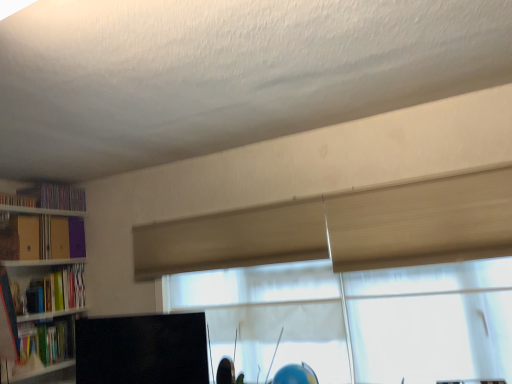
Describe the element at coordinates (142, 349) in the screenshot. I see `black matte computer monitor at lower center` at that location.

How much space does purple cardboard book at upper left, positioned as the 5th book in bottom-to-top order, occupy horizontally?

The width of purple cardboard book at upper left, positioned as the 5th book in bottom-to-top order, is 3.42 inches.

I want to click on purple cardboard book at upper left, positioned as the 5th book in bottom-to-top order, so click(x=18, y=200).

In order to face hardcover book at left, positioned as the 4th book in top-to-bottom order, should I rotate leftwards or rightwards?

Rotate your view left by about 25.379°.

Image resolution: width=512 pixels, height=384 pixels. What do you see at coordinates (48, 340) in the screenshot? I see `matte green book at left, which ranks as the 1th book in bottom-to-top order` at bounding box center [48, 340].

In order to face translucent wood glass door at upper right, should I rotate leftwards or rightwards?

You should look right and rotate roughly 22.272 degrees.

Describe the element at coordinates (44, 280) in the screenshot. I see `wooden bookshelf at left` at that location.

At what (x,y) coordinates should I click in order to perform the action: click on black matte computer monitor at lower center. Please return your answer as a coordinate pair (x, y). The width and height of the screenshot is (512, 384). Looking at the image, I should click on (142, 349).

In the scene shown: Is translucent fabric window at center to the left of translucent wood glass door at upper right from the viewer's perspective?

Yes, translucent fabric window at center is to the left of translucent wood glass door at upper right.

Is translucent fabric window at center next to translucent wood glass door at upper right and touching it?

No, translucent fabric window at center is not next to translucent wood glass door at upper right.

From the picture: Which of these two, translucent fabric window at center or translucent wood glass door at upper right, is smaller?

translucent wood glass door at upper right.

The width and height of the screenshot is (512, 384). Identify the location of the 2nd book behind the matte yellow folder at left, the third book from the top, starting your count from the anchor. (48, 197).

How different are the orientations of matte yellow folder at left, the third book from the top, and matte plastic bookshelf at left, which appears as the 2th book when viewed from the top, in degrees?

The facing directions of matte yellow folder at left, the third book from the top, and matte plastic bookshelf at left, which appears as the 2th book when viewed from the top, are 3.21 degrees apart.

From the image's perspective, relative to matte plastic bookshelf at left, the fourth book in the bottom-to-top sequence, is matte yellow folder at left, the third book from the top, above or below?

From the image's perspective, matte yellow folder at left, the third book from the top, appears below matte plastic bookshelf at left, the fourth book in the bottom-to-top sequence.

Is matte yellow folder at left, arranged as the 3th book when ordered from the bottom, located outside matte plastic bookshelf at left, which appears as the 2th book when viewed from the top?

Yes, matte yellow folder at left, arranged as the 3th book when ordered from the bottom, is outside of matte plastic bookshelf at left, which appears as the 2th book when viewed from the top.

How many degrees apart are the facing directions of purple cardboard book at upper left, positioned as the 5th book in bottom-to-top order, and translucent fabric window at center?

They differ by 88.8 degrees in their facing directions.

Looking at this image, is purple cardboard book at upper left, positioned as the 5th book in bottom-to-top order, facing towards translucent fabric window at center?

No, purple cardboard book at upper left, positioned as the 5th book in bottom-to-top order, is not oriented towards translucent fabric window at center.

From a real-world perspective, is purple cardboard book at upper left, positioned as the 5th book in bottom-to-top order, above or below translucent fabric window at center?

purple cardboard book at upper left, positioned as the 5th book in bottom-to-top order, is above translucent fabric window at center.

Is purple cardboard book at upper left, positioned as the 5th book in bottom-to-top order, wider than translucent fabric window at center?

Incorrect, the width of purple cardboard book at upper left, positioned as the 5th book in bottom-to-top order, does not surpass that of translucent fabric window at center.

Does hardcover book at left, which appears as the second book when ordered from the bottom, touch purple cardboard book at upper left, positioned as the 5th book in bottom-to-top order?

They are not placed beside each other.

Is hardcover book at left, which appears as the second book when ordered from the bottom, not inside purple cardboard book at upper left, which ranks as the 1th book in top-to-bottom order?

Yes, hardcover book at left, which appears as the second book when ordered from the bottom, is located beyond the bounds of purple cardboard book at upper left, which ranks as the 1th book in top-to-bottom order.

From the image's perspective, relative to purple cardboard book at upper left, positioned as the 5th book in bottom-to-top order, is hardcover book at left, which appears as the second book when ordered from the bottom, above or below?

Based on their image positions, hardcover book at left, which appears as the second book when ordered from the bottom, is located beneath purple cardboard book at upper left, positioned as the 5th book in bottom-to-top order.

Can you confirm if hardcover book at left, positioned as the 4th book in top-to-bottom order, is shorter than purple cardboard book at upper left, which ranks as the 1th book in top-to-bottom order?

In fact, hardcover book at left, positioned as the 4th book in top-to-bottom order, may be taller than purple cardboard book at upper left, which ranks as the 1th book in top-to-bottom order.

Consider the image. How many degrees apart are the facing directions of translucent wood glass door at upper right and wooden bookshelf at left?

They differ by 94 degrees in their facing directions.

Is translucent wood glass door at upper right directly adjacent to wooden bookshelf at left?

No.

Can you confirm if translucent wood glass door at upper right is taller than wooden bookshelf at left?

Indeed, translucent wood glass door at upper right has a greater height compared to wooden bookshelf at left.

From a real-world perspective, which object stands above the other?

wooden bookshelf at left is physically above.

Considering the relative positions of wooden bookshelf at left and matte plastic bookshelf at left, which appears as the 2th book when viewed from the top, in the image provided, is wooden bookshelf at left to the left or to the right of matte plastic bookshelf at left, which appears as the 2th book when viewed from the top,?

In the image, wooden bookshelf at left appears on the right side of matte plastic bookshelf at left, which appears as the 2th book when viewed from the top.

From a real-world perspective, between wooden bookshelf at left and matte plastic bookshelf at left, which appears as the 2th book when viewed from the top, who is vertically lower?

wooden bookshelf at left, from a real-world perspective.

How different are the orientations of wooden bookshelf at left and matte plastic bookshelf at left, which appears as the 2th book when viewed from the top, in degrees?

Result: wooden bookshelf at left and matte plastic bookshelf at left, which appears as the 2th book when viewed from the top, are facing 3.94 degrees away from each other.

Does point (67, 307) come behind point (39, 196)?

That is False.

How much distance is there between translucent wood glass door at upper right and matte green book at left, placed as the fifth book when sorted from top to bottom?

translucent wood glass door at upper right and matte green book at left, placed as the fifth book when sorted from top to bottom, are 2.28 meters apart from each other.

From a real-world perspective, is translucent wood glass door at upper right over matte green book at left, which ranks as the 1th book in bottom-to-top order?

Indeed, from a real-world perspective, translucent wood glass door at upper right stands above matte green book at left, which ranks as the 1th book in bottom-to-top order.

Can you confirm if translucent wood glass door at upper right is smaller than matte green book at left, placed as the fifth book when sorted from top to bottom?

Actually, translucent wood glass door at upper right might be larger than matte green book at left, placed as the fifth book when sorted from top to bottom.

From the image's perspective, between translucent wood glass door at upper right and matte green book at left, placed as the fifth book when sorted from top to bottom, which one is located above?

translucent wood glass door at upper right is shown above in the image.

Find the location of a particular element. Image resolution: width=512 pixels, height=384 pixels. window located underneath the translucent wood glass door at upper right (from a real-world perspective) is located at coordinates (269, 315).

This screenshot has width=512, height=384. Identify the location of book that is the 2nd object located behind the matte yellow folder at left, arranged as the 3th book when ordered from the bottom. (48, 197).

Looking at this image, which object lies nearer to the anchor point hardcover book at left, positioned as the 4th book in top-to-bottom order, translucent fabric window at center or black matte computer monitor at lower center?

Among the two, black matte computer monitor at lower center is located nearer to hardcover book at left, positioned as the 4th book in top-to-bottom order.

Looking at the image, which one is located further to hardcover book at left, which appears as the second book when ordered from the bottom, translucent fabric window at center or wooden bookshelf at left?

translucent fabric window at center is further to hardcover book at left, which appears as the second book when ordered from the bottom.

Consider the image. When comparing their distances from translucent wood glass door at upper right, does hardcover book at left, which appears as the second book when ordered from the bottom, or matte plastic bookshelf at left, the fourth book in the bottom-to-top sequence, seem closer?

hardcover book at left, which appears as the second book when ordered from the bottom, is closer to translucent wood glass door at upper right.

Based on their spatial positions, is wooden bookshelf at left or matte yellow folder at left, arranged as the 3th book when ordered from the bottom, closer to translucent wood glass door at upper right?

The object closer to translucent wood glass door at upper right is wooden bookshelf at left.

Which object lies further to the anchor point matte green book at left, placed as the fifth book when sorted from top to bottom, translucent fabric window at center or black matte computer monitor at lower center?

The object further to matte green book at left, placed as the fifth book when sorted from top to bottom, is translucent fabric window at center.

Considering their positions, is black matte computer monitor at lower center positioned further to matte green book at left, which ranks as the 1th book in bottom-to-top order, than hardcover book at left, positioned as the 4th book in top-to-bottom order?

black matte computer monitor at lower center is further to matte green book at left, which ranks as the 1th book in bottom-to-top order.

Looking at the image, which one is located closer to matte plastic bookshelf at left, which appears as the 2th book when viewed from the top, translucent fabric window at center or translucent wood glass door at upper right?

Based on the image, translucent fabric window at center appears to be nearer to matte plastic bookshelf at left, which appears as the 2th book when viewed from the top.

Considering their positions, is purple cardboard book at upper left, which ranks as the 1th book in top-to-bottom order, positioned closer to matte green book at left, which ranks as the 1th book in bottom-to-top order, than hardcover book at left, which appears as the second book when ordered from the bottom?

The object closer to matte green book at left, which ranks as the 1th book in bottom-to-top order, is hardcover book at left, which appears as the second book when ordered from the bottom.

I want to click on bookcase located between purple cardboard book at upper left, positioned as the 5th book in bottom-to-top order, and black matte computer monitor at lower center in the left-right direction, so click(x=44, y=280).

Identify the location of computer monitor between matte yellow folder at left, arranged as the 3th book when ordered from the bottom, and translucent wood glass door at upper right. Image resolution: width=512 pixels, height=384 pixels. (142, 349).

The width and height of the screenshot is (512, 384). Find the location of `computer monitor between wooden bookshelf at left and matte yellow folder at left, the third book from the top, in the front-back direction`. computer monitor between wooden bookshelf at left and matte yellow folder at left, the third book from the top, in the front-back direction is located at coordinates (142, 349).

In order to click on bookcase situated between hardcover book at left, positioned as the 4th book in top-to-bottom order, and translucent wood glass door at upper right from left to right in this screenshot , I will do `click(44, 280)`.